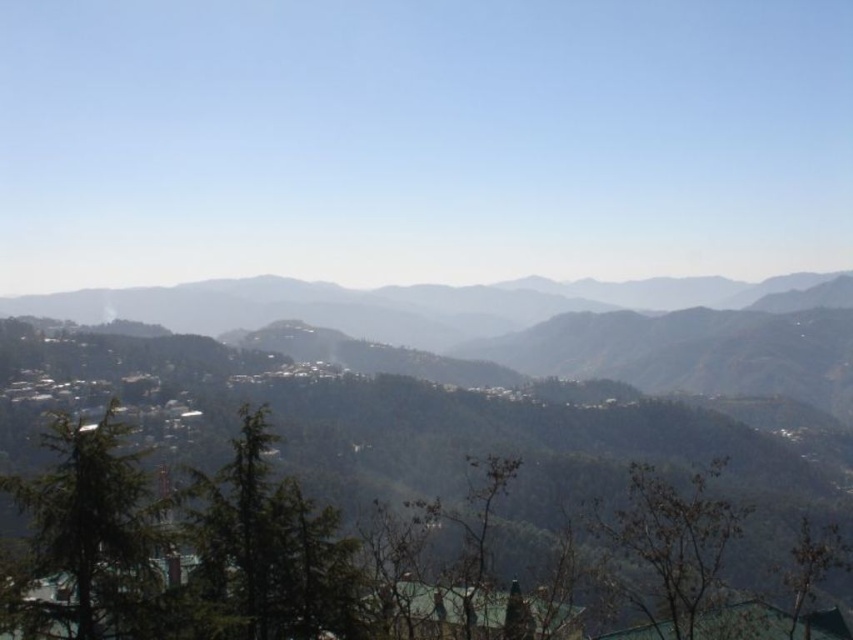
Question: Is green matte tree at center thinner than green matte tree at left?

Choices:
 (A) no
 (B) yes

Answer: (B)

Question: Which object is the closest to the green leafy tree at lower right?

Choices:
 (A) green matte tree at center
 (B) green textured hillside at center
 (C) brown textured tree at lower right
 (D) green matte tree at left

Answer: (C)

Question: Which object is farther from the camera taking this photo?

Choices:
 (A) green textured hillside at center
 (B) green matte tree at center

Answer: (A)

Question: Which object is positioned closest to the brown textured tree at lower right?

Choices:
 (A) green matte tree at center
 (B) green leafy tree at lower right
 (C) green matte tree at left
 (D) green textured hillside at center

Answer: (B)

Question: Is green matte tree at left smaller than brown textured tree at lower right?

Choices:
 (A) no
 (B) yes

Answer: (B)

Question: Is green matte tree at center above green leafy tree at lower right?

Choices:
 (A) no
 (B) yes

Answer: (B)